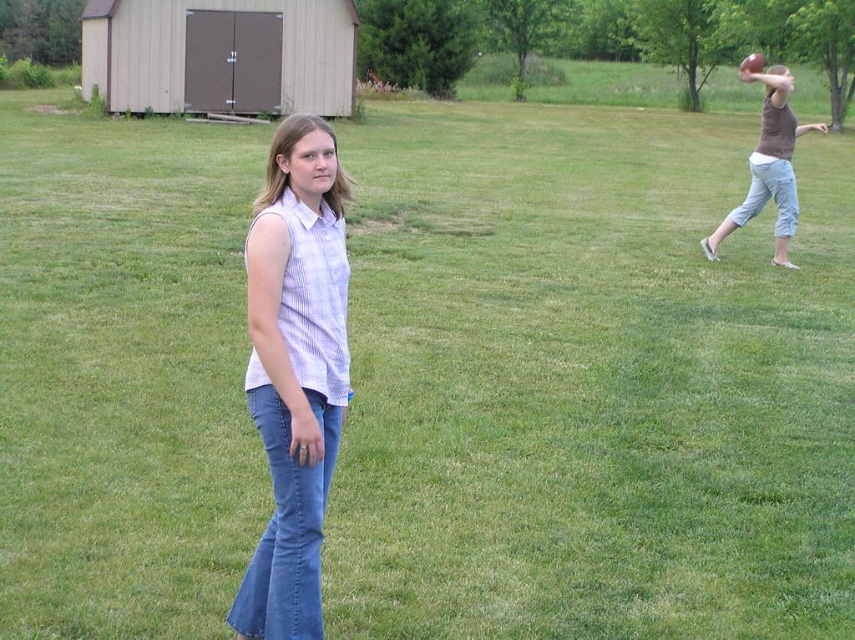
What are the coordinates of the denim jeans at center?

The denim jeans at center is located at point (293, 371).

You are standing at the origin point of the field. You see two points marked in the image. Which point is closer to you, point (270, 186) or point (759, 138)?

Point (270, 186) is in front of point (759, 138), so it is closer to you.